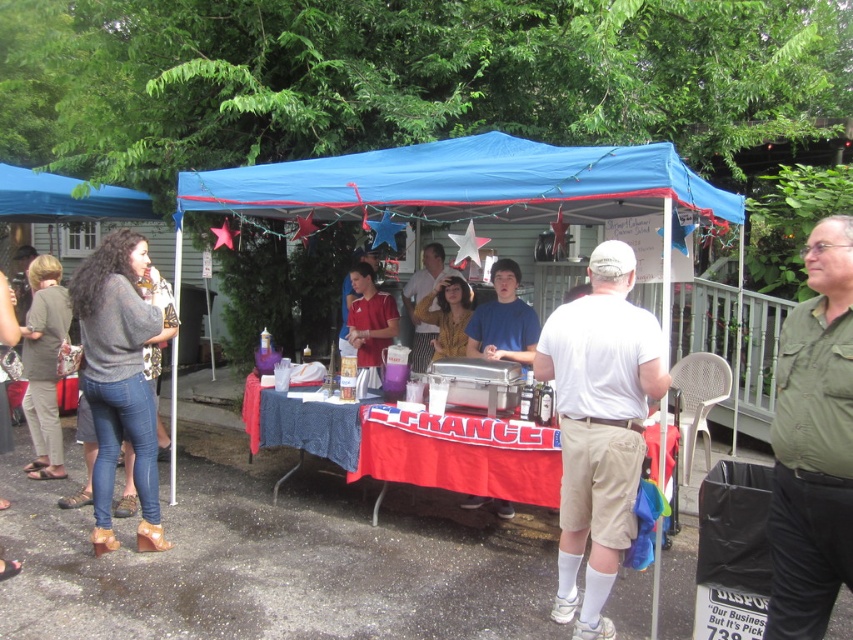
Question: Which point is farther to the camera?

Choices:
 (A) blue fabric canopy at upper left
 (B) yellow striped shirt at center

Answer: (A)

Question: Can you confirm if blue fabric tent at center is smaller than green cotton shirt at center?

Choices:
 (A) no
 (B) yes

Answer: (A)

Question: Which object is the closest to the blue fabric canopy at center?

Choices:
 (A) blue fabric canopy at upper left
 (B) blue fabric tent at center
 (C) green cotton shirt at center
 (D) yellow striped shirt at center

Answer: (B)

Question: Which of the following is the closest to the observer?

Choices:
 (A) pos(810,637)
 (B) pos(737,220)

Answer: (A)

Question: Considering the relative positions of blue fabric canopy at center and yellow striped shirt at center in the image provided, where is blue fabric canopy at center located with respect to yellow striped shirt at center?

Choices:
 (A) above
 (B) below

Answer: (A)

Question: Is green cotton shirt at center closer to the viewer compared to yellow striped shirt at center?

Choices:
 (A) yes
 (B) no

Answer: (A)